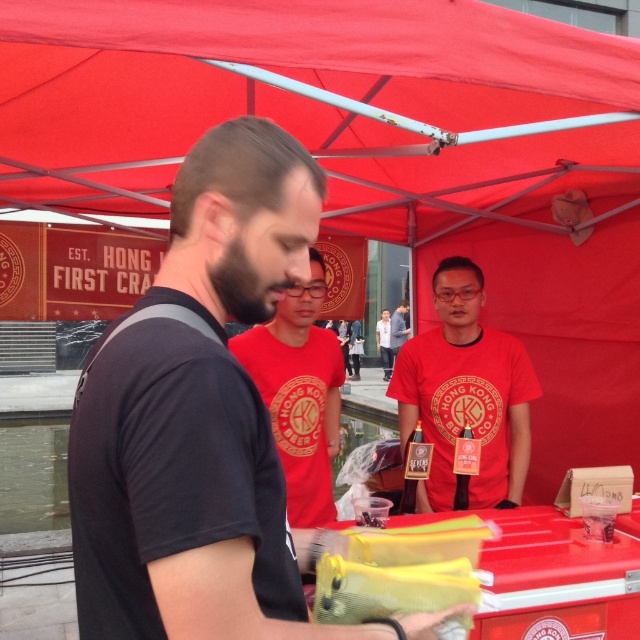
Where is `white cotton shirt at center`? Image resolution: width=640 pixels, height=640 pixels. white cotton shirt at center is located at coordinates (385, 342).

In the scene shown: Is white cotton shirt at center positioned behind matte red shirt at center?

That is True.

Which is in front, point (378, 332) or point (394, 339)?

Positioned in front is point (394, 339).

Where is `white cotton shirt at center`? white cotton shirt at center is located at coordinates (385, 342).

Looking at this image, who is taller, matte red t-shirt at center or matte red shirt at center?

matte red shirt at center

Is point (440, 436) more distant than point (401, 330)?

That is False.

You are a GUI agent. You are given a task and a screenshot of the screen. Output one action in this format:
    pyautogui.click(x=<x>, y=<y>)
    Task: Click on the matte red t-shirt at center
    The image size is (640, 640).
    Given the screenshot: What is the action you would take?
    pyautogui.click(x=467, y=394)

Find the location of a particular element. matte red t-shirt at center is located at coordinates (467, 394).

Can you confirm if matte red t-shirt at center is shorter than red matte shirt at center?

Incorrect, matte red t-shirt at center's height does not fall short of red matte shirt at center's.

This screenshot has height=640, width=640. Describe the element at coordinates (467, 394) in the screenshot. I see `matte red t-shirt at center` at that location.

Where is `matte red t-shirt at center`? This screenshot has width=640, height=640. matte red t-shirt at center is located at coordinates (467, 394).